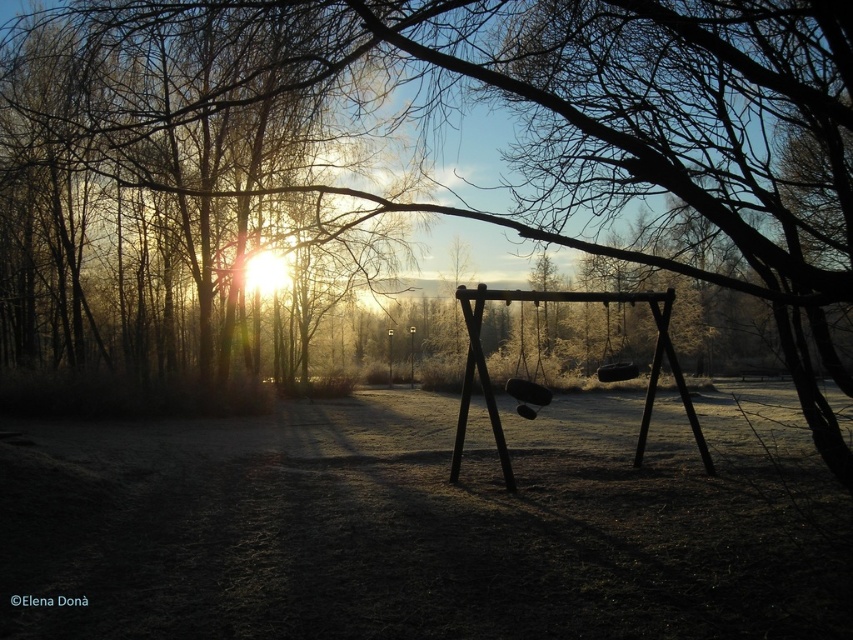
Does wooden swing at center come in front of black rubber swing at center?

Yes, it is in front of black rubber swing at center.

Is wooden swing at center wider than black rubber swing at center?

Incorrect, wooden swing at center's width does not surpass black rubber swing at center's.

Who is more forward, (524, 397) or (607, 381)?

Point (524, 397)

Locate an element on the screen. The height and width of the screenshot is (640, 853). wooden swing at center is located at coordinates (527, 396).

Which of these two, brown wooden swing at center or wooden swing at center, stands taller?

wooden swing at center is taller.

The width and height of the screenshot is (853, 640). What do you see at coordinates (480, 385) in the screenshot?
I see `brown wooden swing at center` at bounding box center [480, 385].

The image size is (853, 640). Describe the element at coordinates (480, 385) in the screenshot. I see `brown wooden swing at center` at that location.

Find the location of a particular element. This screenshot has width=853, height=640. brown wooden swing at center is located at coordinates (480, 385).

Does brown wooden swing at center have a lesser height compared to black rubber swing at center?

No.

Is brown wooden swing at center above black rubber swing at center?

No, brown wooden swing at center is not above black rubber swing at center.

Which is behind, point (496, 428) or point (607, 374)?

The point (607, 374) is more distant.

The image size is (853, 640). I want to click on brown wooden swing at center, so click(x=480, y=385).